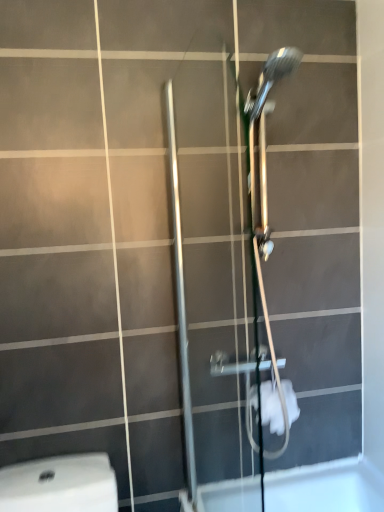
Question: Is white fabric toilet paper at lower center completely or partially inside satin nickel shower door at center?

Choices:
 (A) no
 (B) yes

Answer: (A)

Question: Is satin nickel shower door at center oriented away from white fabric toilet paper at lower center?

Choices:
 (A) no
 (B) yes

Answer: (B)

Question: From a real-world perspective, does satin nickel shower door at center sit lower than white fabric toilet paper at lower center?

Choices:
 (A) no
 (B) yes

Answer: (A)

Question: Is satin nickel shower door at center not close to white fabric toilet paper at lower center?

Choices:
 (A) yes
 (B) no

Answer: (B)

Question: Does satin nickel shower door at center have a greater width compared to white fabric toilet paper at lower center?

Choices:
 (A) no
 (B) yes

Answer: (A)

Question: From the image's perspective, is satin nickel shower door at center on top of white fabric toilet paper at lower center?

Choices:
 (A) yes
 (B) no

Answer: (A)

Question: Is white fabric toilet paper at lower center in contact with satin nickel shower door at center?

Choices:
 (A) yes
 (B) no

Answer: (B)

Question: Is white fabric toilet paper at lower center bigger than satin nickel shower door at center?

Choices:
 (A) no
 (B) yes

Answer: (A)

Question: Does white fabric toilet paper at lower center turn towards satin nickel shower door at center?

Choices:
 (A) yes
 (B) no

Answer: (B)

Question: From a real-world perspective, does white fabric toilet paper at lower center sit lower than satin nickel shower door at center?

Choices:
 (A) yes
 (B) no

Answer: (A)

Question: Is white fabric toilet paper at lower center facing away from satin nickel shower door at center?

Choices:
 (A) no
 (B) yes

Answer: (A)

Question: Is white fabric toilet paper at lower center to the left of satin nickel shower door at center from the viewer's perspective?

Choices:
 (A) yes
 (B) no

Answer: (B)

Question: Considering the positions of white fabric toilet paper at lower center and satin nickel shower door at center in the image, is white fabric toilet paper at lower center bigger or smaller than satin nickel shower door at center?

Choices:
 (A) small
 (B) big

Answer: (A)